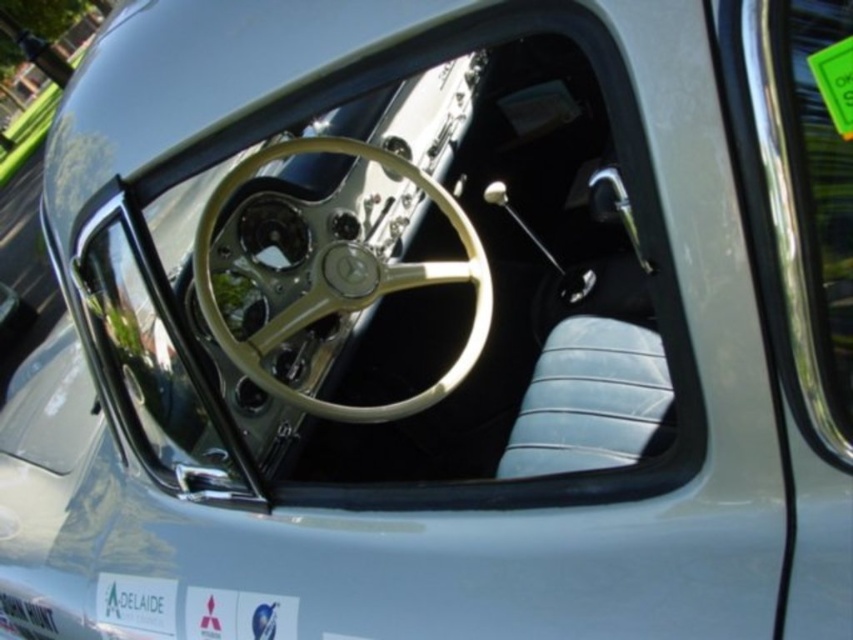
You are a mechanic working on a vintage car. You need to reach the point at coordinates point (772, 93) from the steering wheel. The tools you have are 30 inches long. Can you safely reach the point without extending beyond the tools length?

The distance between the steering wheel and the point (772, 93) is 32.73 inches. Since the tools are only 30 inches long, you cannot safely reach the point without exceeding the tool length.

You are inside the driver seat of the vintage car and want to roll down the polished chrome window at right. Based on its 2D location coordinates, is the window positioned to your left or right side?

The polished chrome window at right is located at coordinates x 0.350 and y 0.923, which places it on the right side of the car, so it is positioned to your right side from the driver seat.